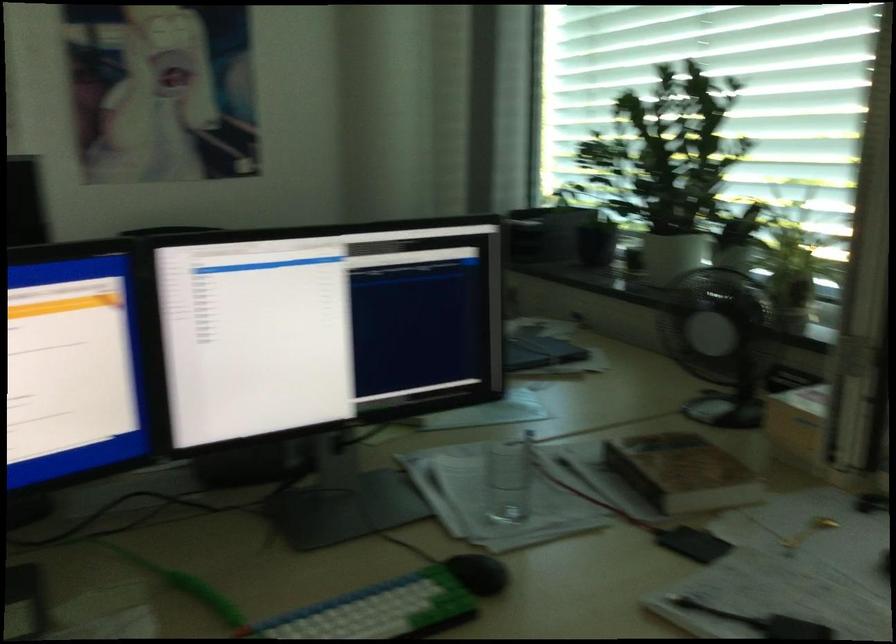
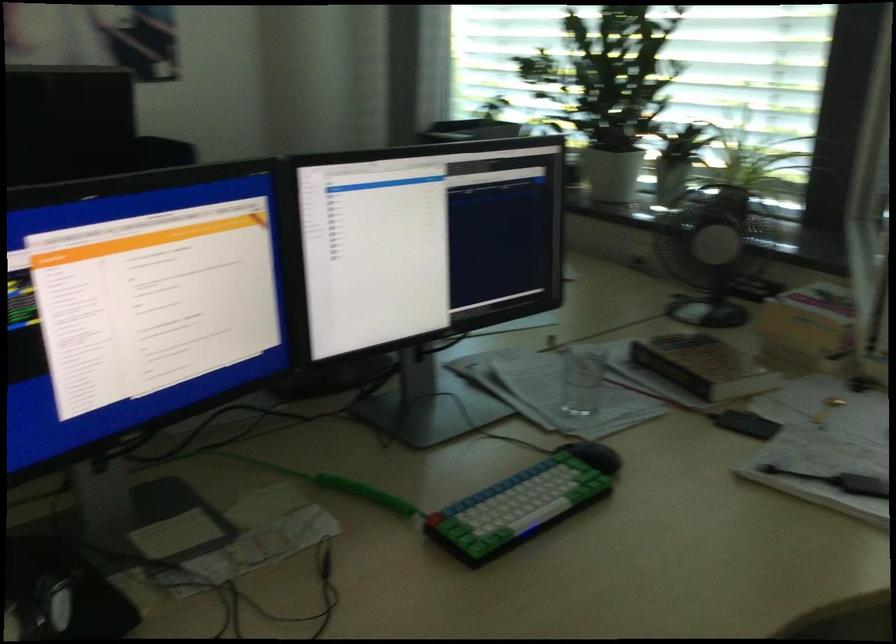
Question: I am providing you with two images of the same scene from different viewpoints. Which of the following objects are not visible in image2?

Choices:
 (A) small black fan
 (B) white plant pot
 (C) black computer mouse
 (D) none of these

Answer: (D)